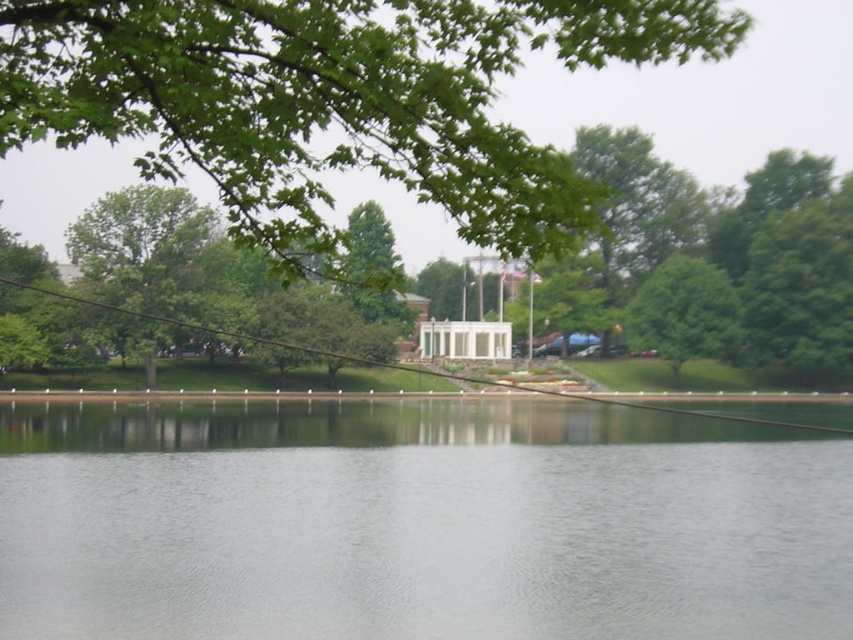
You are standing at the lakeside and want to take a photo of the clear water at center and the green leafy tree at center. Which object should you focus on first if you want to capture both in a single frame? Explain your reasoning based on their positions.

You should focus on the green leafy tree at center first because it is above the clear water at center. By focusing on the tree, you can ensure the water below remains in the same plane of focus, allowing both elements to be captured clearly in the photo.

You are standing on the lakeside path and notice both the clear water at center and the green leafy branch at upper center in your view. Which object is positioned to the right of the other?

The clear water at center is to the right of the green leafy branch at upper center.

You are standing at the center of the image and want to reach the clear water at center. Which direction should you move in to get there?

Since you are already at the center of the image, you are already at the clear water at center.